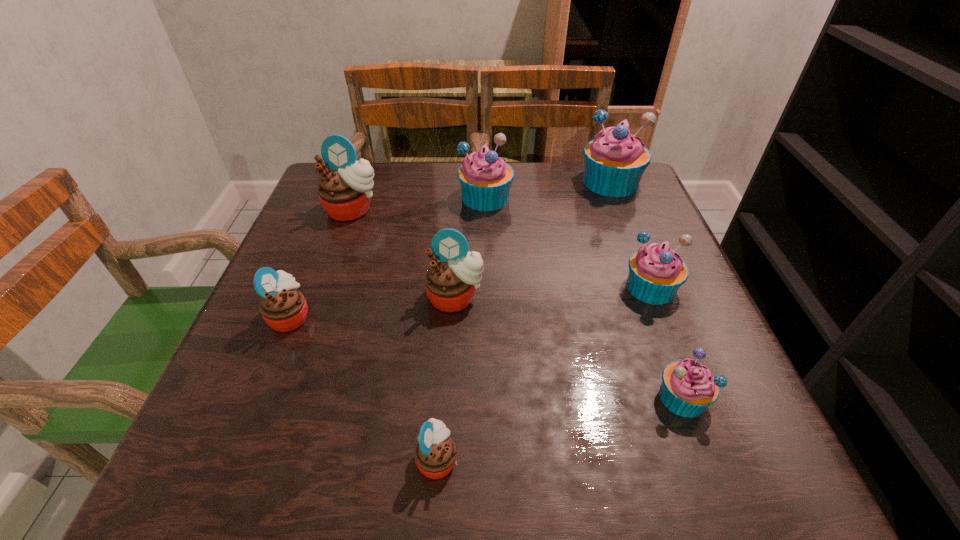
The width and height of the screenshot is (960, 540). I want to click on object located at the far right corner, so click(615, 160).

I want to click on free region at the far edge of the desktop, so click(x=439, y=192).

The width and height of the screenshot is (960, 540). In order to click on free space at the near edge in this screenshot , I will do `click(557, 465)`.

Image resolution: width=960 pixels, height=540 pixels. I want to click on vacant position at the left edge of the desktop, so click(358, 244).

Locate an element on the screen. free spot at the right edge of the desktop is located at coordinates (627, 222).

The image size is (960, 540). Identify the location of free region at the near right corner of the desktop. (733, 444).

The width and height of the screenshot is (960, 540). I want to click on free space between the third biggest pink muffin and the leftmost blue muffin, so click(388, 257).

In order to click on unoccupied area between the second biggest blue muffin and the biggest blue muffin in this screenshot , I will do `click(548, 190)`.

Locate an element on the screen. empty space between the nearest pink muffin and the leftmost blue muffin is located at coordinates (462, 328).

Locate an element on the screen. The width and height of the screenshot is (960, 540). free point between the third smallest blue muffin and the biggest blue muffin is located at coordinates (548, 190).